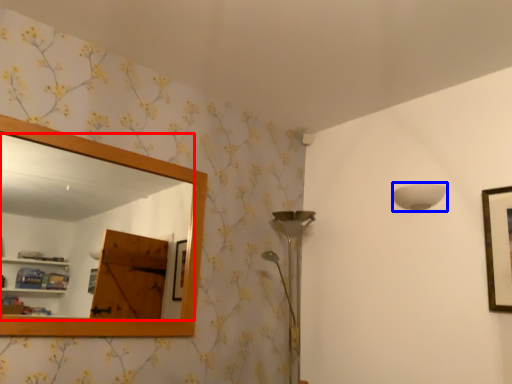
Question: Which of the following is the closest to the observer, mirror (highlighted by a red box) or lamp (highlighted by a blue box)?

Choices:
 (A) mirror
 (B) lamp

Answer: (A)